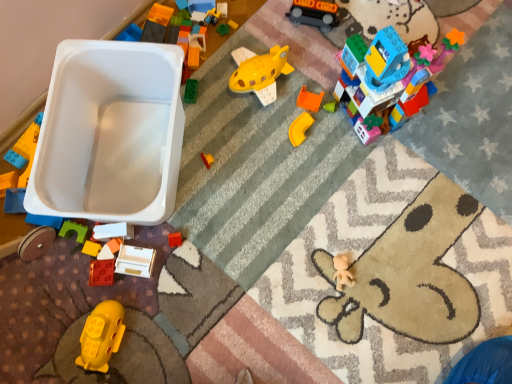
Where is `free space that is in between shiny black train at upper center, the eighth toy ordered from the bottom, and multicolored plastic building block at upper right, the first toy when ordered from right to left`? The image size is (512, 384). free space that is in between shiny black train at upper center, the eighth toy ordered from the bottom, and multicolored plastic building block at upper right, the first toy when ordered from right to left is located at coordinates (323, 49).